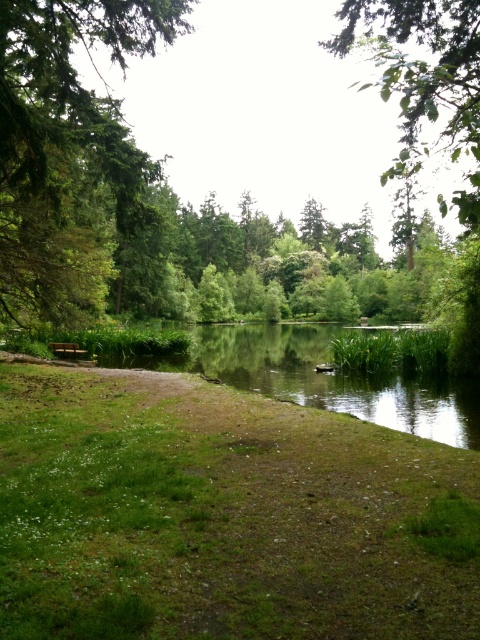
You are a gardener who needs to water the green leafy tree at left using a hose that can reach up to 10 meters. You are currently standing at the wooden bench at lower left. Can you water the tree without moving the hose nozzle?

The distance between the green leafy tree at left and the wooden bench at lower left is 10.22 meters. Since the hose can only reach up to 10 meters, you cannot water the tree without moving the hose nozzle.